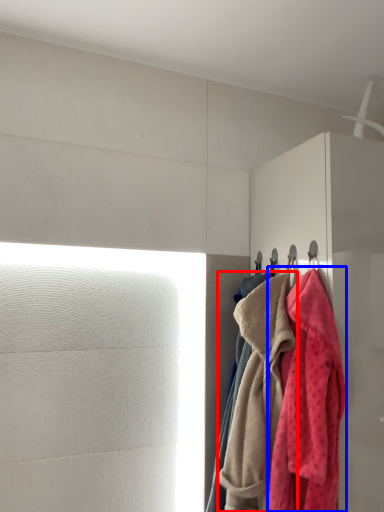
Question: Among these objects, which one is nearest to the camera, towel (highlighted by a red box) or towel (highlighted by a blue box)?

Choices:
 (A) towel
 (B) towel

Answer: (B)